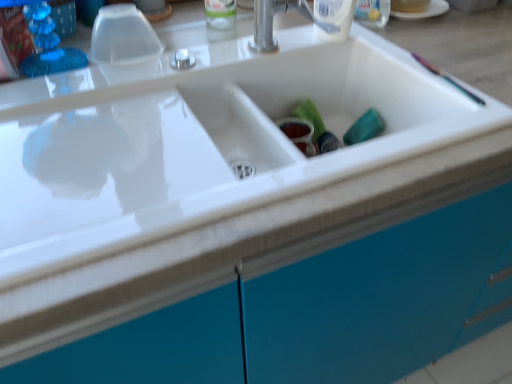
Where is `free point to the left of white glossy bottle at upper right`? This screenshot has height=384, width=512. free point to the left of white glossy bottle at upper right is located at coordinates (273, 47).